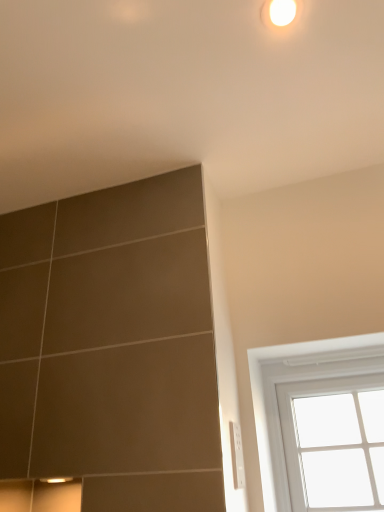
What is the approximate height of white glass window at upper right?

44.02 centimeters.

Where is `white glossy light at upper center`? Image resolution: width=384 pixels, height=512 pixels. white glossy light at upper center is located at coordinates (280, 14).

You are a GUI agent. You are given a task and a screenshot of the screen. Output one action in this format:
    pyautogui.click(x=<x>, y=<y>)
    Task: Click on the white plastic electrical outlet at lower right
    
    Given the screenshot: What is the action you would take?
    pyautogui.click(x=236, y=455)

The height and width of the screenshot is (512, 384). Identify the location of white glass window at upper right. (302, 384).

Does point (233, 474) appear closer or farther from the camera than point (288, 1)?

Point (233, 474) is positioned farther from the camera compared to point (288, 1).

Does white plastic electrical outlet at lower right have a lesser height compared to white glossy light at upper center?

In fact, white plastic electrical outlet at lower right may be taller than white glossy light at upper center.

Looking at this image, how different are the orientations of white plastic electrical outlet at lower right and white glossy light at upper center in degrees?

The facing directions of white plastic electrical outlet at lower right and white glossy light at upper center are 97.1 degrees apart.

Could you tell me if white plastic electrical outlet at lower right is facing white glossy light at upper center?

No.

Based on the photo, would you say white glass window at upper right is to the left or to the right of white glossy light at upper center in the picture?

white glass window at upper right is positioned on white glossy light at upper center's right side.

From the image's perspective, is white glass window at upper right below white glossy light at upper center?

Indeed, from the image's perspective, white glass window at upper right is shown beneath white glossy light at upper center.

Is white glossy light at upper center located within white glass window at upper right?

No, white glossy light at upper center is located outside of white glass window at upper right.

Where is `light located on the left of white glass window at upper right`? This screenshot has height=512, width=384. light located on the left of white glass window at upper right is located at coordinates (280, 14).

Based on the photo, from the image's perspective, would you say white glass window at upper right is positioned over white plastic electrical outlet at lower right?

No.

Is point (275, 502) farther from camera compared to point (231, 451)?

Yes, it is behind point (231, 451).

Is white glass window at upper right not near white plastic electrical outlet at lower right?

white glass window at upper right is actually quite close to white plastic electrical outlet at lower right.

Can you confirm if white glass window at upper right is bigger than white plastic electrical outlet at lower right?

Yes.

Can you tell me how much white glossy light at upper center and white plastic electrical outlet at lower right differ in facing direction?

97.1 degrees.

Where is `light that is above the white plastic electrical outlet at lower right (from the image's perspective)`? light that is above the white plastic electrical outlet at lower right (from the image's perspective) is located at coordinates (280, 14).

Is white glossy light at upper center looking in the opposite direction of white plastic electrical outlet at lower right?

white glossy light at upper center does not have its back to white plastic electrical outlet at lower right.

Is white glossy light at upper center taller than white plastic electrical outlet at lower right?

No, white glossy light at upper center is not taller than white plastic electrical outlet at lower right.

Find the location of a particular element. Image resolution: width=384 pixels, height=512 pixels. window above the white plastic electrical outlet at lower right (from a real-world perspective) is located at coordinates (302, 384).

Considering the positions of objects white plastic electrical outlet at lower right and white glass window at upper right in the image provided, who is behind, white plastic electrical outlet at lower right or white glass window at upper right?

white glass window at upper right is further from the camera.

Which is in front, point (236, 456) or point (274, 410)?

The point (236, 456) is closer to the camera.

Is the position of white glossy light at upper center more distant than that of white glass window at upper right?

No, it is in front of white glass window at upper right.

Is white glass window at upper right a part of white glossy light at upper center?

Definitely not — white glass window at upper right is not inside white glossy light at upper center.

How distant is white glossy light at upper center from white glass window at upper right?

white glossy light at upper center is 97.65 centimeters away from white glass window at upper right.

From the image's perspective, does white glossy light at upper center appear higher than white glass window at upper right?

Yes, from the image's perspective, white glossy light at upper center is above white glass window at upper right.

Where is `electric outlet located below the white glossy light at upper center (from the image's perspective)`? electric outlet located below the white glossy light at upper center (from the image's perspective) is located at coordinates (236, 455).

Identify the location of light above the white glass window at upper right (from the image's perspective). The height and width of the screenshot is (512, 384). (280, 14).

Considering their positions, is white glass window at upper right positioned closer to white glossy light at upper center than white plastic electrical outlet at lower right?

white plastic electrical outlet at lower right lies closer to white glossy light at upper center than the other object.

Which object lies nearer to the anchor point white plastic electrical outlet at lower right, white glass window at upper right or white glossy light at upper center?

The object closer to white plastic electrical outlet at lower right is white glass window at upper right.

Looking at the image, which one is located further to white glass window at upper right, white plastic electrical outlet at lower right or white glossy light at upper center?

white glossy light at upper center is positioned further to the anchor white glass window at upper right.

Considering their positions, is white plastic electrical outlet at lower right positioned further to white glossy light at upper center than white glass window at upper right?

Based on the image, white glass window at upper right appears to be further to white glossy light at upper center.

When comparing their distances from white plastic electrical outlet at lower right, does white glossy light at upper center or white glass window at upper right seem further?

Based on the image, white glossy light at upper center appears to be further to white plastic electrical outlet at lower right.

Considering their positions, is white glossy light at upper center positioned closer to white glass window at upper right than white plastic electrical outlet at lower right?

Based on the image, white plastic electrical outlet at lower right appears to be nearer to white glass window at upper right.

In order to click on electric outlet that lies between white glossy light at upper center and white glass window at upper right from top to bottom in this screenshot , I will do `click(236, 455)`.